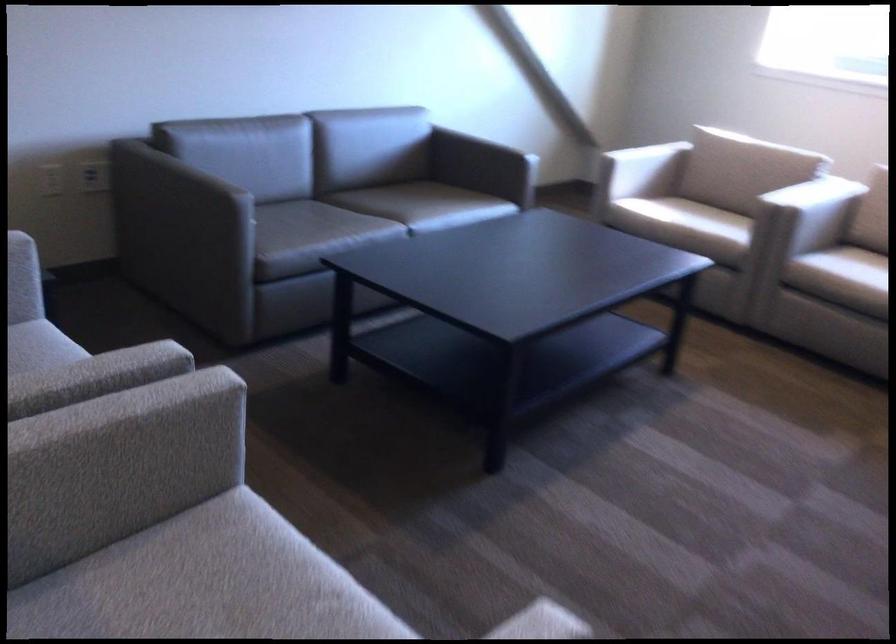
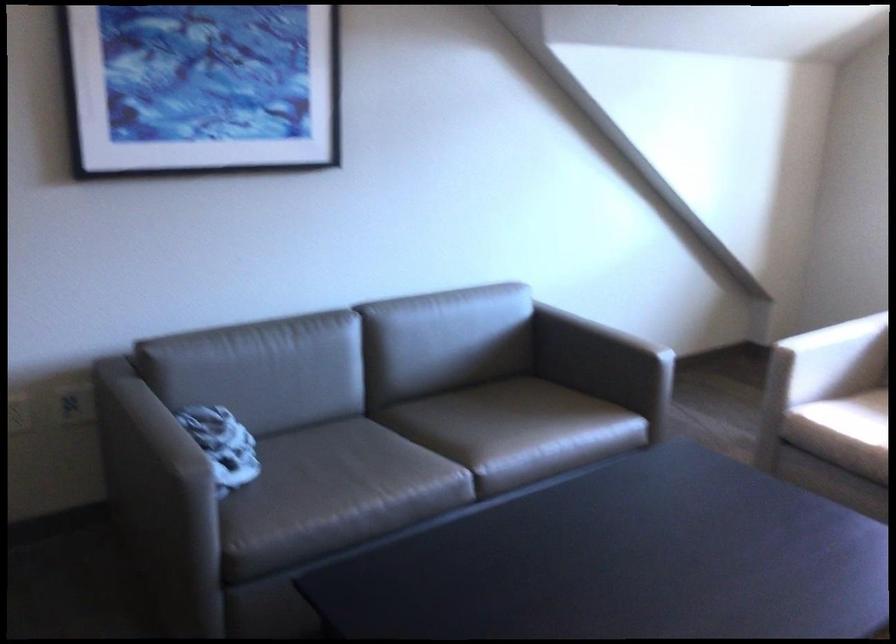
In the second image, find the point that corresponds to (209,204) in the first image.

(158, 491)